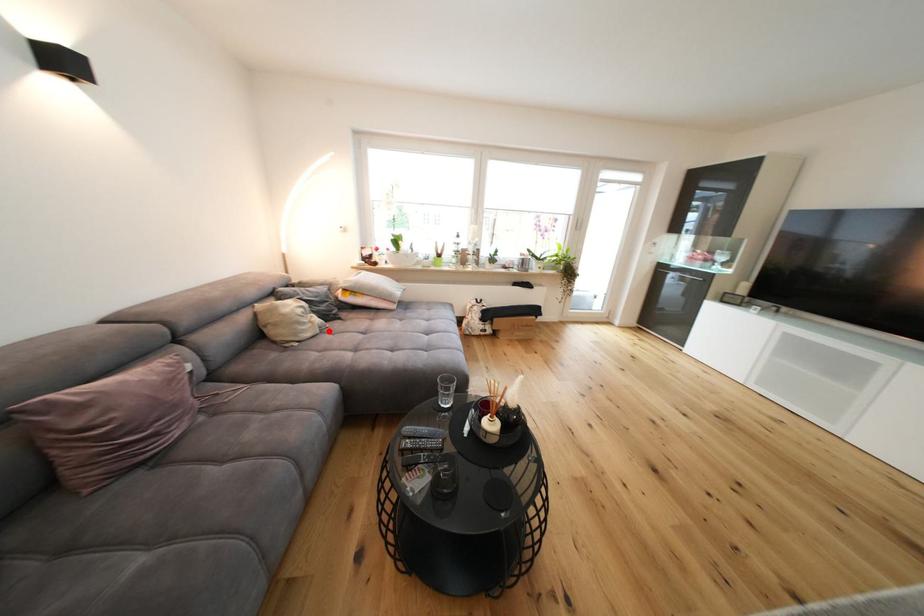
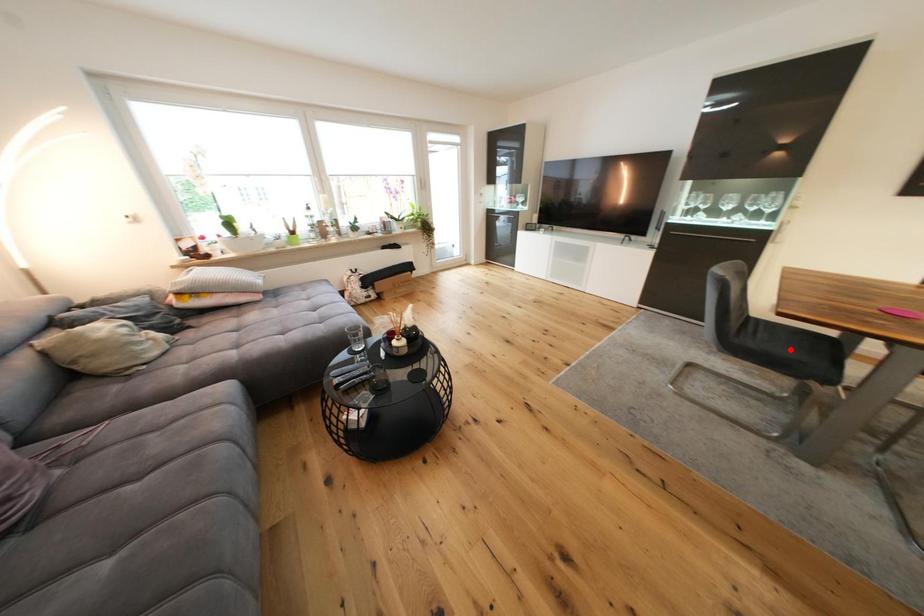
I am providing you with two images of the same scene from different viewpoints. A red point is marked on the first image and another point is marked on the second image. Does the point marked in image1 correspond to the same location as the one in image2?

No